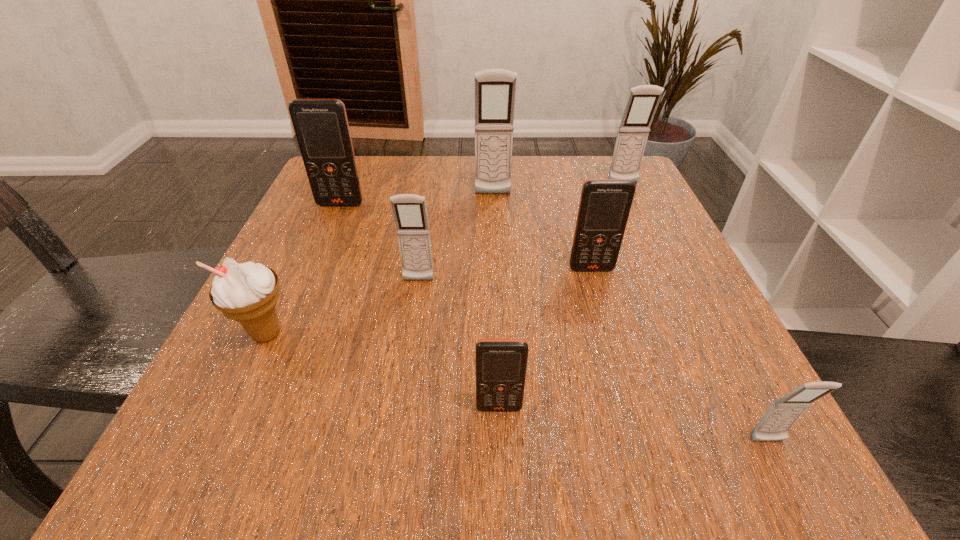
Locate an element on the screen. This screenshot has height=540, width=960. orange cellular telephone that stands as the second closest to the nearest object is located at coordinates (605, 204).